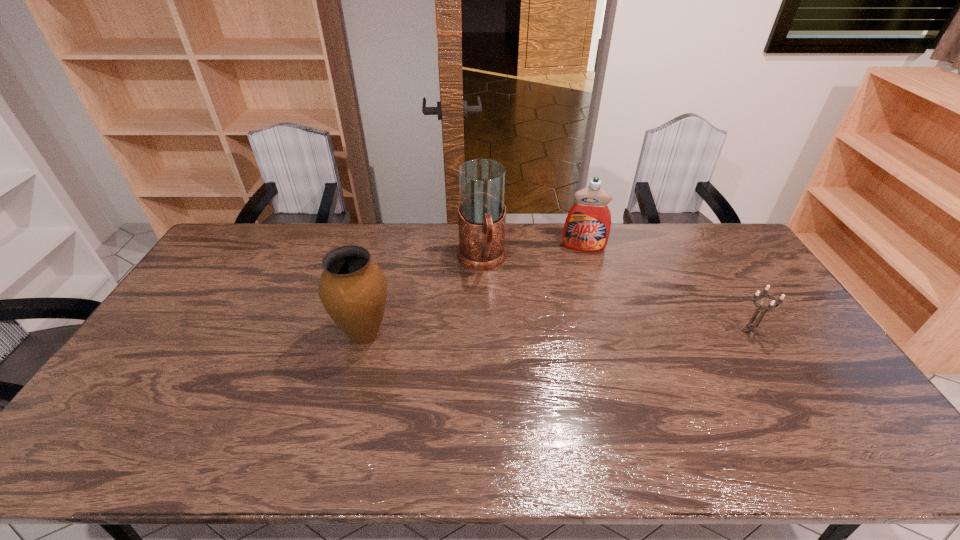
Locate an element on the screen. vacant region between the shortest object and the leftmost object is located at coordinates (557, 333).

What are the coordinates of `vacant area between the shortest object and the tallest object` in the screenshot? It's located at (615, 296).

Locate an element on the screen. This screenshot has height=540, width=960. object that ranks as the closest to the rightmost object is located at coordinates (587, 227).

Locate which object ranks in proximity to the third object from left to right. Please provide its 2D coordinates. Your answer should be formatted as a tuple, i.e. [(x, y)], where the tuple contains the x and y coordinates of a point satisfying the conditions above.

[(482, 213)]

The height and width of the screenshot is (540, 960). Identify the location of vacant space that satisfies the following two spatial constraints: 1. on the back side of the pitcher; 2. on the left side of the detergent. (482, 247).

Locate an element on the screen. free region that satisfies the following two spatial constraints: 1. on the front side of the shortest object; 2. on the right side of the pitcher is located at coordinates (482, 332).

Locate an element on the screen. The image size is (960, 540). free location that satisfies the following two spatial constraints: 1. on the back side of the third object from right to left; 2. on the left side of the leftmost object is located at coordinates (384, 260).

What are the coordinates of `vacant position in the image that satisfies the following two spatial constraints: 1. on the front side of the shortest object; 2. on the left side of the detergent` in the screenshot? It's located at (609, 332).

Find the location of `vacant space that satisfies the following two spatial constraints: 1. on the front side of the rightmost object; 2. on the right side of the third object from left to right`. vacant space that satisfies the following two spatial constraints: 1. on the front side of the rightmost object; 2. on the right side of the third object from left to right is located at coordinates (609, 332).